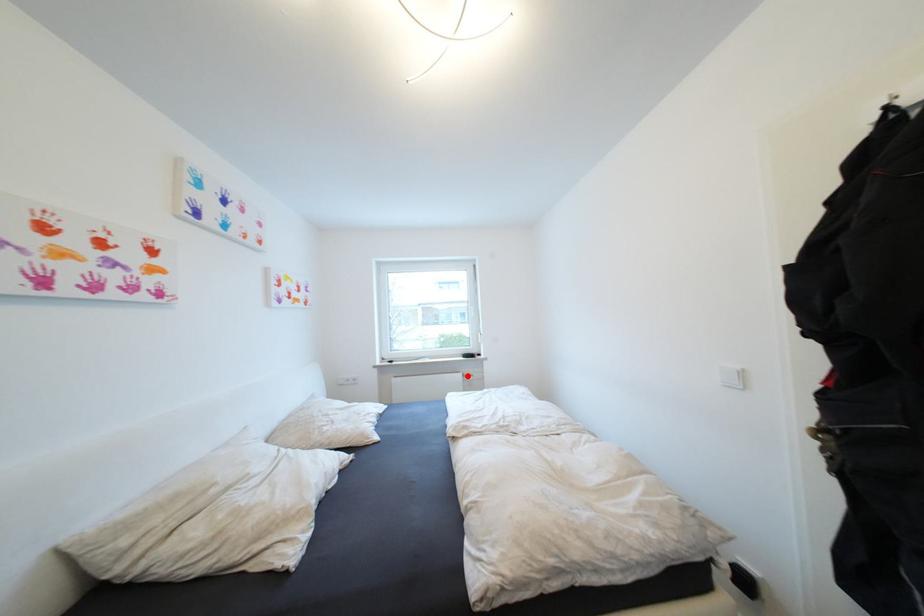
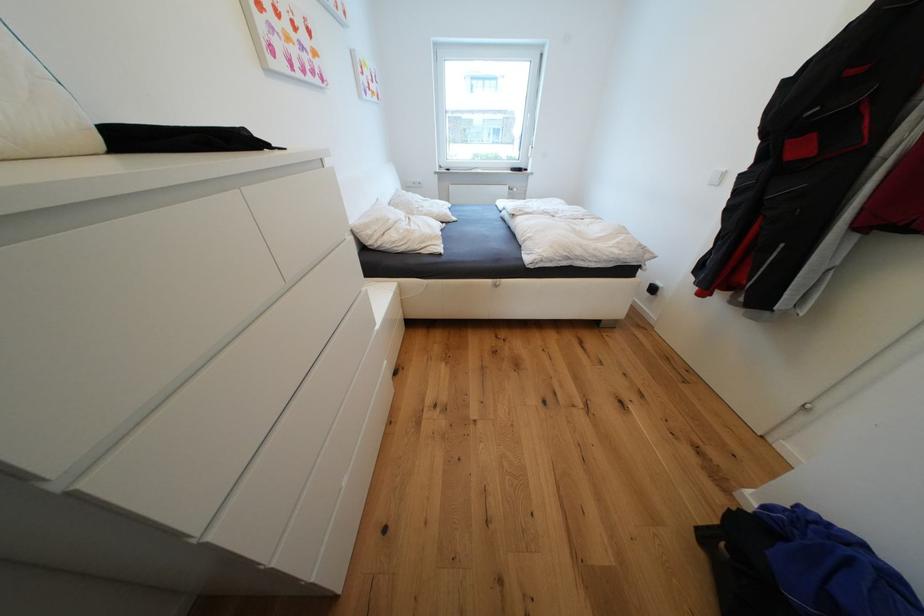
Question: I am providing you with two images of the same scene from different viewpoints. A red point is shown in image1. For the corresponding object point in image2, is it positioned nearer or farther from the camera?

Choices:
 (A) Nearer
 (B) Farther

Answer: (A)